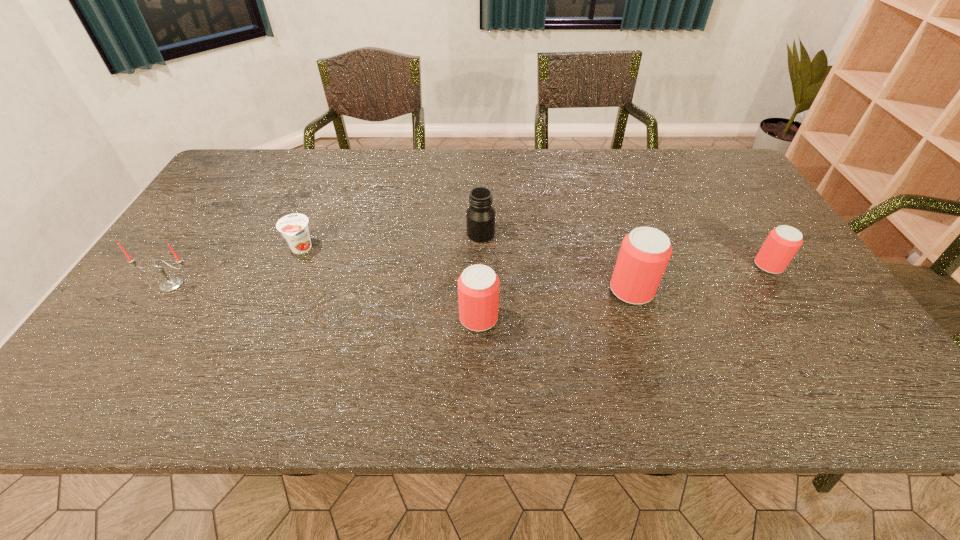
Find the location of a particular element. blank area located 0.160m on the back of the fifth object from left to right is located at coordinates pos(613,234).

The height and width of the screenshot is (540, 960). I want to click on vacant space located on the left of the shortest beer can, so click(x=604, y=266).

Locate an element on the screen. free space located on the left of the jar is located at coordinates (388, 234).

I want to click on free space located on the right of the yogurt, so click(420, 249).

This screenshot has height=540, width=960. In order to click on blank space located on the front-facing side of the leftmost object in this screenshot , I will do `click(135, 339)`.

Where is `object present at the near edge`? This screenshot has height=540, width=960. object present at the near edge is located at coordinates (478, 286).

Locate an element on the screen. This screenshot has width=960, height=540. object that is at the left edge is located at coordinates (172, 283).

Find the location of a particular element. object that is at the right edge is located at coordinates (782, 243).

Locate an element on the screen. The width and height of the screenshot is (960, 540). free spot at the far edge of the desktop is located at coordinates (533, 167).

This screenshot has height=540, width=960. In order to click on vacant space at the near edge of the desktop in this screenshot , I will do `click(219, 354)`.